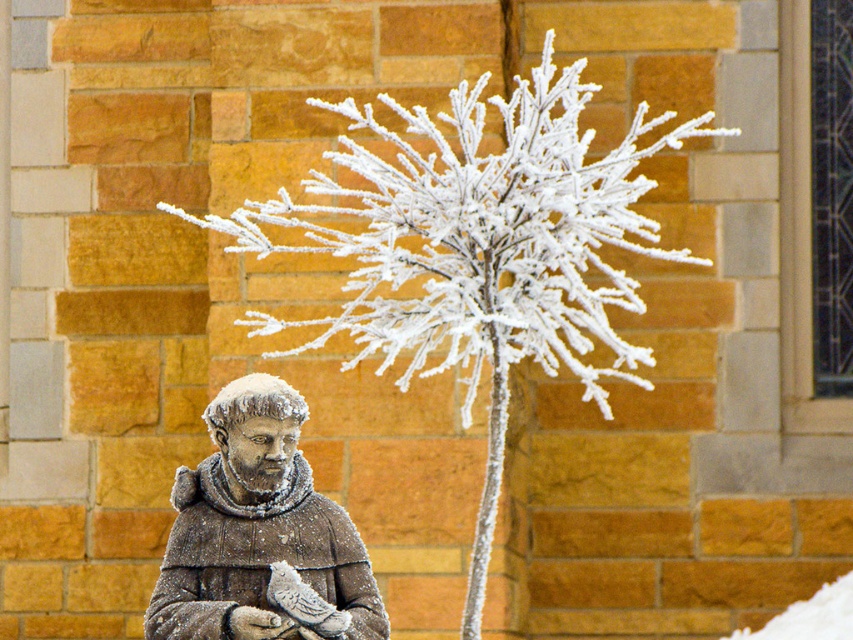
Is frosted white branches at center thinner than frosted stone statue at lower left?

In fact, frosted white branches at center might be wider than frosted stone statue at lower left.

Which is in front, point (532, 349) or point (236, 618)?

Point (236, 618) is more forward.

Locate an element on the screen. frosted white branches at center is located at coordinates point(477,250).

Identify the location of frosted white branches at center. The width and height of the screenshot is (853, 640). (477, 250).